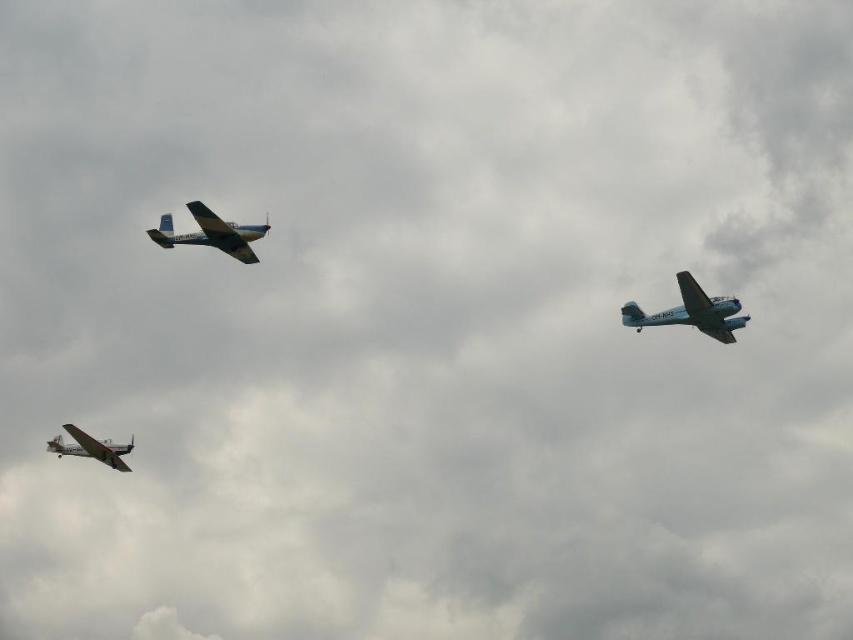
You are a pilot in the foreground plane and want to ascend to join the other two planes. Which of the two planes, the light blue matte airplane at upper right or the metallic blue airplane at upper left, is higher in the sky?

The light blue matte airplane at upper right is higher than the metallic blue airplane at upper left.

You are a pilot in the silver metallic airplane at lower left and want to communicate with the light blue matte airplane at upper right. How far apart are the two airplanes?

The light blue matte airplane at upper right is 28.29 meters away from the silver metallic airplane at lower left, so the distance between them is 28.29 meters.